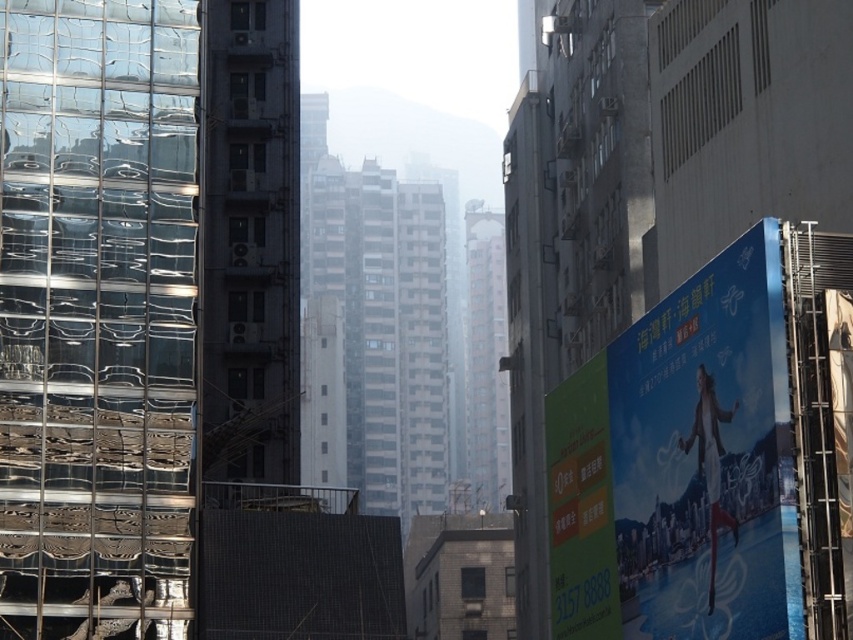
Which is in front, point (76, 484) or point (699, 540)?

Point (699, 540) is in front.

Who is more distant from viewer, (77, 422) or (618, 467)?

Point (618, 467)

In order to click on transparent glass scaffolding at left in this screenshot , I will do `click(97, 316)`.

Does point (32, 88) come in front of point (560, 628)?

Yes, it is in front of point (560, 628).

Does transparent glass scaffolding at left have a larger size compared to green matte signboard at right?

Actually, transparent glass scaffolding at left might be smaller than green matte signboard at right.

Find the location of a particular element. The image size is (853, 640). transparent glass scaffolding at left is located at coordinates (97, 316).

Identify the location of transparent glass scaffolding at left. This screenshot has width=853, height=640. (97, 316).

Can you confirm if blue glossy billboard at right is positioned above green matte signboard at right?

Yes.

Can you confirm if blue glossy billboard at right is taller than green matte signboard at right?

No, blue glossy billboard at right is not taller than green matte signboard at right.

What do you see at coordinates (706, 454) in the screenshot? The image size is (853, 640). I see `blue glossy billboard at right` at bounding box center [706, 454].

In order to click on blue glossy billboard at right in this screenshot , I will do `click(706, 454)`.